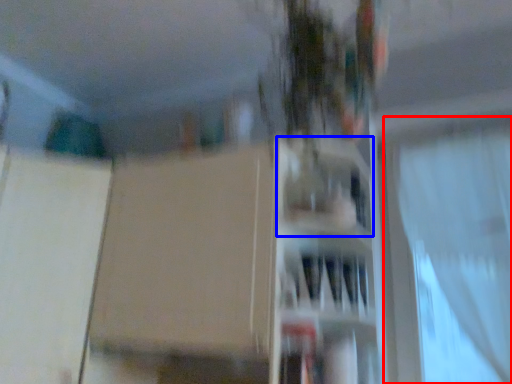
Question: Which point is further to the camera, curtain (highlighted by a red box) or shelf (highlighted by a blue box)?

Choices:
 (A) curtain
 (B) shelf

Answer: (A)